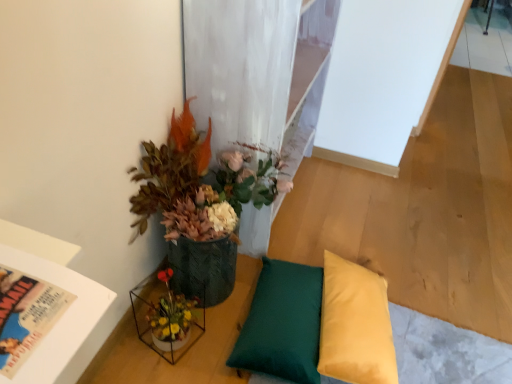
Identify the location of vacant area that is situated to the right of translucent glass vase at lower left. The width and height of the screenshot is (512, 384). (216, 332).